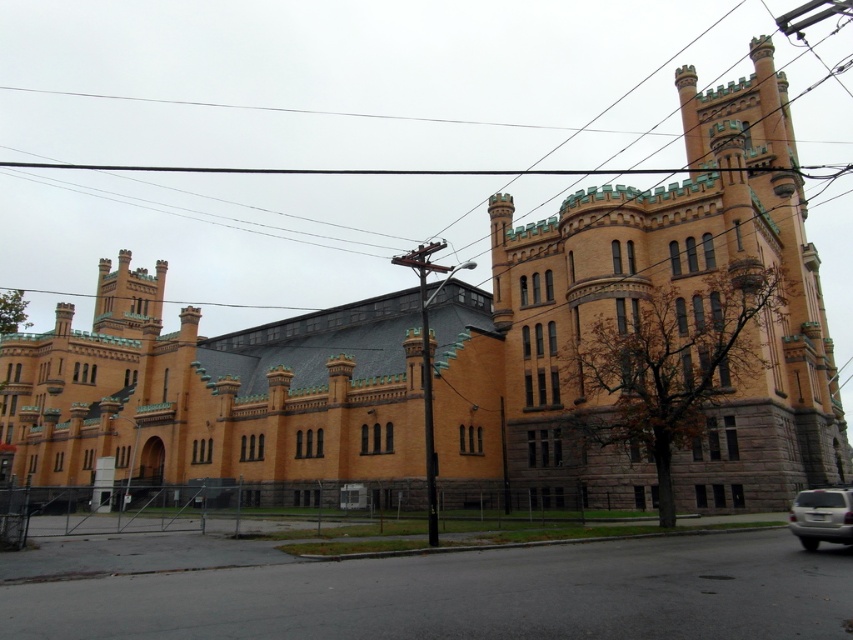
Question: Is black wire at upper center to the left of silver metallic suv at lower right from the viewer's perspective?

Choices:
 (A) no
 (B) yes

Answer: (B)

Question: Which of the following is the farthest from the observer?

Choices:
 (A) black wire at upper center
 (B) silver metallic suv at lower right

Answer: (A)

Question: Is black wire at upper center closer to camera compared to silver metallic suv at lower right?

Choices:
 (A) no
 (B) yes

Answer: (A)

Question: Which point appears farthest from the camera in this image?

Choices:
 (A) (833, 540)
 (B) (86, 220)

Answer: (B)

Question: Among these points, which one is nearest to the camera?

Choices:
 (A) (836, 513)
 (B) (225, 40)

Answer: (A)

Question: Is black wire at upper center below silver metallic suv at lower right?

Choices:
 (A) no
 (B) yes

Answer: (A)